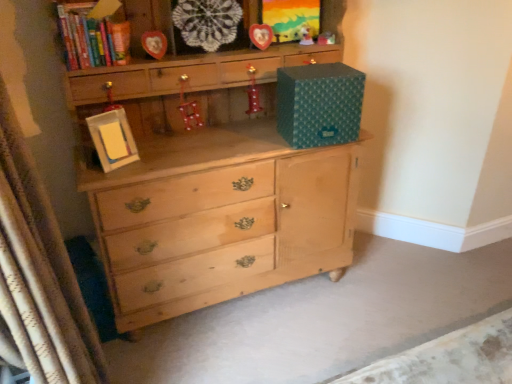
I want to click on white textured curtain at left, so click(x=39, y=275).

Where is `wooden heart-shaped frame at upper center, which is the fourth picture frame in bottom-to-top order`? Image resolution: width=512 pixels, height=384 pixels. wooden heart-shaped frame at upper center, which is the fourth picture frame in bottom-to-top order is located at coordinates (291, 18).

What is the approximate height of wooden heart-shaped frame at upper center, the 1th picture frame in the top-to-bottom sequence?

It is 24.81 centimeters.

Image resolution: width=512 pixels, height=384 pixels. In order to click on wooden heart at center, arranged as the third picture frame when ordered from the bottom in this screenshot , I will do `click(261, 35)`.

What do you see at coordinates (91, 37) in the screenshot?
I see `hardcover book at upper left` at bounding box center [91, 37].

What is the approximate width of hardcover book at upper left?

It is 5.73 inches.

Describe the element at coordinates (154, 43) in the screenshot. I see `matte wooden picture frame at upper center, the third picture frame positioned from the top` at that location.

You are a GUI agent. You are given a task and a screenshot of the screen. Output one action in this format:
    pyautogui.click(x=<x>, y=<y>)
    Task: Click on the white cardboard picture frame at center, the first picture frame from the bottom
    
    Given the screenshot: What is the action you would take?
    pyautogui.click(x=112, y=139)

Who is shorter, wooden heart-shaped frame at upper center, the fourth picture frame when ordered from left to right, or teal paper storage box at upper right?

wooden heart-shaped frame at upper center, the fourth picture frame when ordered from left to right, is shorter.

Can we say wooden heart-shaped frame at upper center, the 1th picture frame viewed from the right, lies outside teal paper storage box at upper right?

That's correct, wooden heart-shaped frame at upper center, the 1th picture frame viewed from the right, is outside of teal paper storage box at upper right.

Are wooden heart-shaped frame at upper center, which is the fourth picture frame in bottom-to-top order, and teal paper storage box at upper right making contact?

No, wooden heart-shaped frame at upper center, which is the fourth picture frame in bottom-to-top order, is not in contact with teal paper storage box at upper right.

Is wooden heart-shaped frame at upper center, the 1th picture frame in the top-to-bottom sequence, facing towards teal paper storage box at upper right?

No, wooden heart-shaped frame at upper center, the 1th picture frame in the top-to-bottom sequence, is not facing towards teal paper storage box at upper right.

From a real-world perspective, is metallic red ornament at center, which is counted as the first toy, starting from the bottom, positioned under white cardboard picture frame at center, the fourth picture frame positioned from the right, based on gravity?

No.

Is metallic red ornament at center, which is counted as the 4th toy, starting from the top, oriented towards white cardboard picture frame at center, placed as the first picture frame when sorted from left to right?

No.

Which object is further away from the camera taking this photo, metallic red ornament at center, which is counted as the first toy, starting from the bottom, or white cardboard picture frame at center, placed as the first picture frame when sorted from left to right?

metallic red ornament at center, which is counted as the first toy, starting from the bottom, is behind.

Looking at the image, does metallic red ornament at center, which is the first toy from left to right, seem bigger or smaller compared to white cardboard picture frame at center, arranged as the fourth picture frame when viewed from the top?

Considering their sizes, metallic red ornament at center, which is the first toy from left to right, takes up less space than white cardboard picture frame at center, arranged as the fourth picture frame when viewed from the top.

Which is in front, point (94, 5) or point (324, 35)?

The point (94, 5) is closer to the camera.

Based on their sizes in the image, would you say hardcover book at upper left is bigger or smaller than matte plastic toy at upper center, the second toy from the top?

Clearly, hardcover book at upper left is larger in size than matte plastic toy at upper center, the second toy from the top.

From a real-world perspective, is hardcover book at upper left under matte plastic toy at upper center, which appears as the first toy when viewed from the right?

Incorrect, from a real-world perspective, hardcover book at upper left is higher than matte plastic toy at upper center, which appears as the first toy when viewed from the right.

Which of these two, hardcover book at upper left or matte plastic toy at upper center, the second toy from the top, is thinner?

Thinner between the two is matte plastic toy at upper center, the second toy from the top.

From the image's perspective, which is below, teal paper storage box at upper right or matte wooden picture frame at upper center, the third picture frame positioned from the top?

teal paper storage box at upper right, from the image's perspective.

Between point (294, 104) and point (162, 55), which one is positioned behind?

The point (294, 104) is farther from the camera.

Is teal paper storage box at upper right situated inside matte wooden picture frame at upper center, marked as the third picture frame in a right-to-left arrangement, or outside?

teal paper storage box at upper right lies outside matte wooden picture frame at upper center, marked as the third picture frame in a right-to-left arrangement.

Between teal paper storage box at upper right and matte wooden picture frame at upper center, marked as the third picture frame in a right-to-left arrangement, which one has smaller width?

Thinner between the two is matte wooden picture frame at upper center, marked as the third picture frame in a right-to-left arrangement.

Is shiny red boot at center, positioned as the 3th toy in right-to-left order, oriented towards white cardboard picture frame at center, placed as the first picture frame when sorted from left to right?

No, shiny red boot at center, positioned as the 3th toy in right-to-left order, is not aimed at white cardboard picture frame at center, placed as the first picture frame when sorted from left to right.

Measure the distance from shiny red boot at center, which ranks as the 3th toy in top-to-bottom order, to white cardboard picture frame at center, arranged as the fourth picture frame when viewed from the top.

shiny red boot at center, which ranks as the 3th toy in top-to-bottom order, is 24.17 inches from white cardboard picture frame at center, arranged as the fourth picture frame when viewed from the top.

Can we say shiny red boot at center, the second toy positioned from the bottom, lies outside white cardboard picture frame at center, the fourth picture frame positioned from the right?

That's correct, shiny red boot at center, the second toy positioned from the bottom, is outside of white cardboard picture frame at center, the fourth picture frame positioned from the right.

From a real-world perspective, is shiny red boot at center, the second toy when ordered from left to right, below white cardboard picture frame at center, arranged as the fourth picture frame when viewed from the top?

Incorrect, from a real-world perspective, shiny red boot at center, the second toy when ordered from left to right, is higher than white cardboard picture frame at center, arranged as the fourth picture frame when viewed from the top.

Is matte plastic toy at upper center, the 2th toy when ordered from right to left, wider or thinner than wooden heart at center, acting as the 2th picture frame starting from the right?

matte plastic toy at upper center, the 2th toy when ordered from right to left, is wider than wooden heart at center, acting as the 2th picture frame starting from the right.

Is matte plastic toy at upper center, the 2th toy when ordered from right to left, positioned with its back to wooden heart at center, the second picture frame in the top-to-bottom sequence?

matte plastic toy at upper center, the 2th toy when ordered from right to left, is not turned away from wooden heart at center, the second picture frame in the top-to-bottom sequence.

Relative to wooden heart at center, acting as the 2th picture frame starting from the right, is matte plastic toy at upper center, the first toy viewed from the top, in front or behind?

matte plastic toy at upper center, the first toy viewed from the top, is positioned farther from the viewer than wooden heart at center, acting as the 2th picture frame starting from the right.

From the image's perspective, who appears lower, matte plastic toy at upper center, marked as the 3th toy in a left-to-right arrangement, or wooden heart at center, acting as the 2th picture frame starting from the right?

wooden heart at center, acting as the 2th picture frame starting from the right, appears lower in the image.

Between teal paper storage box at upper right and white cardboard picture frame at center, the fourth picture frame positioned from the right, which one has smaller width?

Thinner between the two is white cardboard picture frame at center, the fourth picture frame positioned from the right.

How far apart are teal paper storage box at upper right and white cardboard picture frame at center, the fourth picture frame positioned from the right?

teal paper storage box at upper right and white cardboard picture frame at center, the fourth picture frame positioned from the right, are 28.84 inches apart from each other.

Based on the photo, is white cardboard picture frame at center, placed as the first picture frame when sorted from left to right, located within teal paper storage box at upper right?

Definitely not — white cardboard picture frame at center, placed as the first picture frame when sorted from left to right, is not inside teal paper storage box at upper right.

Identify the location of storage box that appears on the right of wooden heart-shaped frame at upper center, the fourth picture frame when ordered from left to right. This screenshot has height=384, width=512. (319, 104).

Locate an element on the screen. The width and height of the screenshot is (512, 384). the 2nd picture frame counting from the left of the metallic red ornament at center, which is counted as the first toy, starting from the bottom is located at coordinates (112, 139).

From the picture: When comparing their distances from shiny red boot at center, the second toy when ordered from left to right, does white textured curtain at left or white cardboard picture frame at center, the fourth picture frame positioned from the right, seem closer?

white cardboard picture frame at center, the fourth picture frame positioned from the right, lies closer to shiny red boot at center, the second toy when ordered from left to right, than the other object.

Consider the image. Looking at the image, which one is located closer to white cardboard picture frame at center, arranged as the fourth picture frame when viewed from the top, hardcover book at upper left or metallic red ornament at center, which is counted as the 4th toy, starting from the top?

hardcover book at upper left is positioned closer to the anchor white cardboard picture frame at center, arranged as the fourth picture frame when viewed from the top.

When comparing their distances from hardcover book at upper left, does wooden heart-shaped frame at upper center, the 1th picture frame in the top-to-bottom sequence, or teal paper storage box at upper right seem further?

Based on the image, teal paper storage box at upper right appears to be further to hardcover book at upper left.

When comparing their distances from hardcover book at upper left, does matte plastic toy at upper center, the 3th toy from the bottom, or matte wooden picture frame at upper center, marked as the third picture frame in a right-to-left arrangement, seem closer?

matte wooden picture frame at upper center, marked as the third picture frame in a right-to-left arrangement, is positioned closer to the anchor hardcover book at upper left.

When comparing their distances from white cardboard picture frame at center, the fourth picture frame positioned from the right, does matte plastic toy at upper center, marked as the 3th toy in a left-to-right arrangement, or metallic red ornament at center, which is counted as the first toy, starting from the bottom, seem closer?

metallic red ornament at center, which is counted as the first toy, starting from the bottom, is positioned closer to the anchor white cardboard picture frame at center, the fourth picture frame positioned from the right.

From the image, which object appears to be farther from white textured curtain at left, matte plastic toy at upper center, marked as the 3th toy in a left-to-right arrangement, or white cardboard picture frame at center, the fourth picture frame positioned from the right?

matte plastic toy at upper center, marked as the 3th toy in a left-to-right arrangement, is further to white textured curtain at left.

From the picture: Looking at the image, which one is located further to matte wooden picture frame at upper center, marked as the third picture frame in a right-to-left arrangement, hardcover book at upper left or matte plastic toy at upper center, the 4th toy positioned from the bottom?

The object further to matte wooden picture frame at upper center, marked as the third picture frame in a right-to-left arrangement, is matte plastic toy at upper center, the 4th toy positioned from the bottom.

Estimate the real-world distances between objects in this image. Which object is further from matte plastic toy at upper center, the 3th toy from the bottom, wooden heart at center, acting as the 2th picture frame starting from the right, or metallic red ornament at center, which is the first toy from left to right?

Among the two, metallic red ornament at center, which is the first toy from left to right, is located further to matte plastic toy at upper center, the 3th toy from the bottom.

Where is `toy located between matte wooden picture frame at upper center, marked as the third picture frame in a right-to-left arrangement, and shiny red boot at center, the second toy positioned from the bottom, in the left-right direction`? This screenshot has height=384, width=512. toy located between matte wooden picture frame at upper center, marked as the third picture frame in a right-to-left arrangement, and shiny red boot at center, the second toy positioned from the bottom, in the left-right direction is located at coordinates (188, 108).

This screenshot has height=384, width=512. In order to click on storage box positioned between white textured curtain at left and matte wooden picture frame at upper center, which is the 2th picture frame from left to right, from near to far in this screenshot , I will do `click(319, 104)`.

This screenshot has width=512, height=384. Find the location of `storage box positioned between white textured curtain at left and wooden heart at center, acting as the 2th picture frame starting from the right, from near to far`. storage box positioned between white textured curtain at left and wooden heart at center, acting as the 2th picture frame starting from the right, from near to far is located at coordinates (319, 104).

The width and height of the screenshot is (512, 384). What are the coordinates of `picture frame located between white textured curtain at left and teal paper storage box at upper right in the depth direction` in the screenshot? It's located at (112, 139).